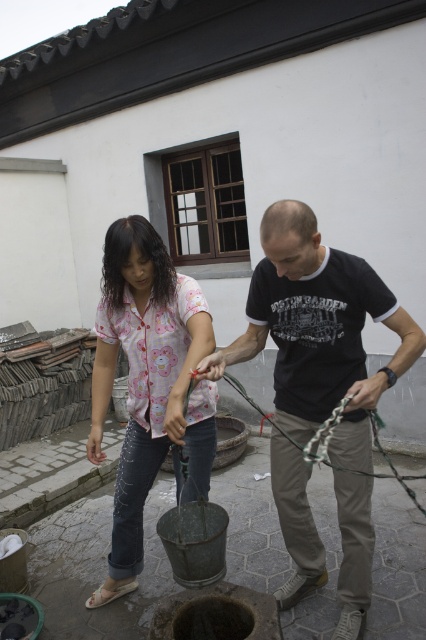
Question: Which point appears farthest from the camera in this image?

Choices:
 (A) (135, 349)
 (B) (293, 618)
 (C) (319, 454)
 (D) (299, 339)

Answer: (B)

Question: Which object is the closest to the smooth concrete well at center?

Choices:
 (A) black cotton shirt at center
 (B) floral cotton shirt at center
 (C) green rubber rope at center

Answer: (C)

Question: Is smooth concrete well at center further to camera compared to green rubber rope at center?

Choices:
 (A) yes
 (B) no

Answer: (A)

Question: Estimate the real-world distances between objects in this image. Which object is farther from the green rubber rope at center?

Choices:
 (A) smooth concrete well at center
 (B) floral cotton shirt at center

Answer: (A)

Question: Does black cotton shirt at center have a greater width compared to smooth concrete well at center?

Choices:
 (A) yes
 (B) no

Answer: (B)

Question: Where is floral cotton shirt at center located in relation to green rubber rope at center in the image?

Choices:
 (A) right
 (B) left

Answer: (B)